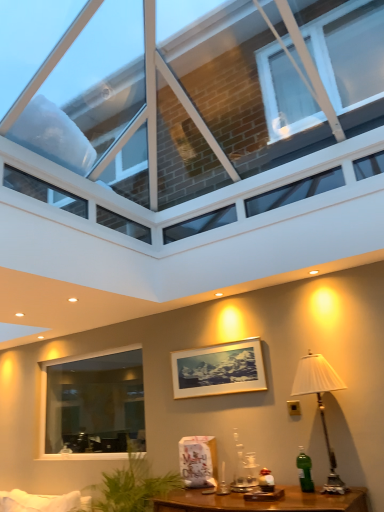
Question: From a real-world perspective, is green glass bottle at lower right under clear glass window at lower left, positioned as the second window in front-to-back order?

Choices:
 (A) yes
 (B) no

Answer: (A)

Question: Can you confirm if green glass bottle at lower right is wider than clear glass window at lower left, marked as the 1th window in a back-to-front arrangement?

Choices:
 (A) no
 (B) yes

Answer: (B)

Question: Is green glass bottle at lower right further to the viewer compared to clear glass window at lower left, the 2th window positioned from the top?

Choices:
 (A) yes
 (B) no

Answer: (B)

Question: From the image's perspective, is green glass bottle at lower right on clear glass window at lower left, positioned as the second window in front-to-back order?

Choices:
 (A) no
 (B) yes

Answer: (B)

Question: Is green glass bottle at lower right shorter than clear glass window at lower left, which ranks as the 1th window in bottom-to-top order?

Choices:
 (A) no
 (B) yes

Answer: (B)

Question: Can you confirm if green glass bottle at lower right is positioned to the right of clear glass window at lower left, which ranks as the 1th window in bottom-to-top order?

Choices:
 (A) yes
 (B) no

Answer: (A)

Question: Is white fabric lampshade at right wider than gold-framed picture at center?

Choices:
 (A) no
 (B) yes

Answer: (B)

Question: Does white fabric lampshade at right have a lesser width compared to gold-framed picture at center?

Choices:
 (A) no
 (B) yes

Answer: (A)

Question: Is white fabric lampshade at right to the left of gold-framed picture at center from the viewer's perspective?

Choices:
 (A) no
 (B) yes

Answer: (A)

Question: Considering the relative sizes of white fabric lampshade at right and gold-framed picture at center in the image provided, is white fabric lampshade at right bigger than gold-framed picture at center?

Choices:
 (A) no
 (B) yes

Answer: (B)

Question: Can you confirm if white fabric lampshade at right is shorter than gold-framed picture at center?

Choices:
 (A) yes
 (B) no

Answer: (B)

Question: Does white fabric lampshade at right come in front of gold-framed picture at center?

Choices:
 (A) yes
 (B) no

Answer: (A)

Question: From the image's perspective, does green glass bottle at lower right appear higher than gold-framed picture at center?

Choices:
 (A) no
 (B) yes

Answer: (A)